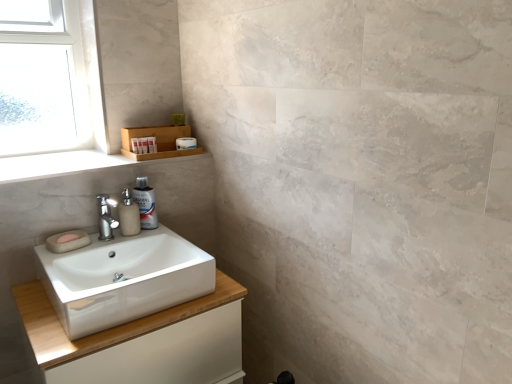
Locate an element on the screen. This screenshot has width=512, height=384. white glossy cabinet at lower left is located at coordinates pos(104,330).

Where is `translucent plastic spray bottle at sink`? The height and width of the screenshot is (384, 512). translucent plastic spray bottle at sink is located at coordinates (145, 203).

Measure the distance between matte beige soap at left and camera.

1.46 meters.

Describe the element at coordinates (151, 145) in the screenshot. This screenshot has height=384, width=512. I see `white matte tube at upper left, marked as the 2th toiletry in a front-to-back arrangement` at that location.

Describe the element at coordinates (134, 145) in the screenshot. Image resolution: width=512 pixels, height=384 pixels. I see `white matte container at upper left, which is counted as the second toiletry, starting from the back` at that location.

Describe the element at coordinates (106, 217) in the screenshot. I see `polished chrome faucet at center` at that location.

This screenshot has height=384, width=512. In order to click on white glossy cabinet at lower left in this screenshot , I will do `click(104, 330)`.

Is wooden tray at upper left with white glossy cabinet at lower left?

No, wooden tray at upper left is not in contact with white glossy cabinet at lower left.

Between wooden tray at upper left and white glossy cabinet at lower left, which one has larger width?

Wider between the two is white glossy cabinet at lower left.

Is wooden tray at upper left facing towards white glossy cabinet at lower left?

No, wooden tray at upper left is not facing towards white glossy cabinet at lower left.

Is white glossy sink at lower left surrounded by matte beige soap at left?

→ No, white glossy sink at lower left is not surrounded by matte beige soap at left.

How many degrees apart are the facing directions of matte beige soap at left and white glossy sink at lower left?

They differ by 3.8 degrees in their facing directions.

Is matte beige soap at left beside white glossy sink at lower left?

matte beige soap at left is not next to white glossy sink at lower left, and they're not touching.

How distant is matte beige soap at left from white glossy sink at lower left?

matte beige soap at left is 11.86 inches away from white glossy sink at lower left.

Are white matte container at upper left, which is counted as the 2th toiletry, starting from the right, and white matte toilet paper at upper center located far from each other?

white matte container at upper left, which is counted as the 2th toiletry, starting from the right, is near white matte toilet paper at upper center, not far away.

From a real-world perspective, who is located lower, white matte container at upper left, which is counted as the second toiletry, starting from the back, or white matte toilet paper at upper center?

From a 3D spatial view, white matte toilet paper at upper center is below.

Considering the relative positions of white matte container at upper left, which ranks as the 1th toiletry in front-to-back order, and white matte toilet paper at upper center in the image provided, is white matte container at upper left, which ranks as the 1th toiletry in front-to-back order, behind white matte toilet paper at upper center?

No, white matte container at upper left, which ranks as the 1th toiletry in front-to-back order, is in front of white matte toilet paper at upper center.

Is white matte container at upper left, which is counted as the second toiletry, starting from the back, aimed at white matte toilet paper at upper center?

No, white matte container at upper left, which is counted as the second toiletry, starting from the back, does not turn towards white matte toilet paper at upper center.

Does point (190, 297) come farther from viewer compared to point (64, 340)?

Yes, point (190, 297) is farther from viewer.

Which of these two, white glossy sink at lower left or white glossy cabinet at lower left, is wider?

Wider between the two is white glossy cabinet at lower left.

Is white glossy sink at lower left in front of or behind white glossy cabinet at lower left in the image?

white glossy sink at lower left is behind white glossy cabinet at lower left.

Is white glossy sink at lower left bigger than white glossy cabinet at lower left?

No.

How distant is polished chrome faucet at center from white matte container at upper left, which is counted as the second toiletry, starting from the back?

11.78 inches.

Can you tell me how much polished chrome faucet at center and white matte container at upper left, which is counted as the 2th toiletry, starting from the right, differ in facing direction?

There is a 1.46-degree angle between the facing directions of polished chrome faucet at center and white matte container at upper left, which is counted as the 2th toiletry, starting from the right.

Could you tell me if polished chrome faucet at center is turned towards white matte container at upper left, which is counted as the second toiletry, starting from the back?

No.

Does point (105, 240) come in front of point (134, 151)?

Yes, it is in front of point (134, 151).

Considering their positions, is matte beige soap at left located in front of or behind white glossy cabinet at lower left?

Clearly, matte beige soap at left is behind white glossy cabinet at lower left.

Is point (70, 241) positioned after point (169, 323)?

Yes, it is behind point (169, 323).

Which of these two, matte beige soap at left or white glossy cabinet at lower left, stands taller?

With more height is white glossy cabinet at lower left.

Between matte beige soap at left and white glossy cabinet at lower left, which one has larger width?

white glossy cabinet at lower left is wider.

In the scene shown: Considering the sizes of objects white matte tube at upper left, which appears as the 1th toiletry when viewed from the right, and wooden tray at upper left in the image provided, who is shorter, white matte tube at upper left, which appears as the 1th toiletry when viewed from the right, or wooden tray at upper left?

With less height is wooden tray at upper left.

From a real-world perspective, is white matte tube at upper left, marked as the 2th toiletry in a front-to-back arrangement, on wooden tray at upper left?

Yes, from a real-world perspective, white matte tube at upper left, marked as the 2th toiletry in a front-to-back arrangement, is over wooden tray at upper left

Does white matte tube at upper left, placed as the 1th toiletry when sorted from back to front, turn towards wooden tray at upper left?

No, white matte tube at upper left, placed as the 1th toiletry when sorted from back to front, is not aimed at wooden tray at upper left.

Between white matte tube at upper left, marked as the 2th toiletry in a front-to-back arrangement, and wooden tray at upper left, which one is positioned behind?

white matte tube at upper left, marked as the 2th toiletry in a front-to-back arrangement, is more distant.

What are the coordinates of `window sill on the left side of white glossy cabinet at lower left` in the screenshot? It's located at (66, 164).

This screenshot has height=384, width=512. Find the location of `soap located behind the white glossy sink at lower left`. soap located behind the white glossy sink at lower left is located at coordinates (68, 238).

Based on their spatial positions, is matte beige soap at left or wooden shelf at upper left closer to wooden tray at upper left?

wooden shelf at upper left.

Consider the image. Which object lies further to the anchor point white matte tube at upper left, the 2th toiletry positioned from the left, wooden tray at upper left or wooden shelf at upper left?

wooden tray at upper left.

Based on their spatial positions, is clear glass window at upper left or wooden tray at upper left further from white matte toilet paper at upper center?

The object further to white matte toilet paper at upper center is clear glass window at upper left.

When comparing their distances from clear glass window at upper left, does translucent plastic spray bottle at sink or white matte container at upper left, marked as the 1th toiletry in a left-to-right arrangement, seem closer?

white matte container at upper left, marked as the 1th toiletry in a left-to-right arrangement, lies closer to clear glass window at upper left than the other object.

Which object lies nearer to the anchor point white glossy sink at lower left, polished chrome faucet at center or matte beige soap at left?

Among the two, polished chrome faucet at center is located nearer to white glossy sink at lower left.

From the image, which object appears to be farther from white glossy cabinet at lower left, white matte tube at upper left, the 2th toiletry positioned from the left, or beige matte soap dispenser at center?

Among the two, white matte tube at upper left, the 2th toiletry positioned from the left, is located further to white glossy cabinet at lower left.

Which object lies further to the anchor point matte beige soap at left, polished chrome faucet at center or white matte container at upper left, which is counted as the second toiletry, starting from the back?

The object further to matte beige soap at left is white matte container at upper left, which is counted as the second toiletry, starting from the back.

Based on their spatial positions, is white glossy cabinet at lower left or white matte toilet paper at upper center closer to wooden tray at upper left?

white matte toilet paper at upper center.

The width and height of the screenshot is (512, 384). Find the location of `tap between white glossy sink at lower left and wooden shelf at upper left along the z-axis`. tap between white glossy sink at lower left and wooden shelf at upper left along the z-axis is located at coordinates coord(106,217).

Image resolution: width=512 pixels, height=384 pixels. In order to click on soap between wooden tray at upper left and white glossy cabinet at lower left in the up-down direction in this screenshot , I will do `click(68, 238)`.

The image size is (512, 384). Identify the location of cleaning product between clear glass window at upper left and white matte toilet paper at upper center from left to right. (145, 203).

You are a GUI agent. You are given a task and a screenshot of the screen. Output one action in this format:
    pyautogui.click(x=<x>, y=<y>)
    Task: Click on the soap dispenser between matte beige soap at left and translucent plastic spray bottle at sink in the horizontal direction
    The image size is (512, 384).
    Given the screenshot: What is the action you would take?
    pyautogui.click(x=129, y=215)